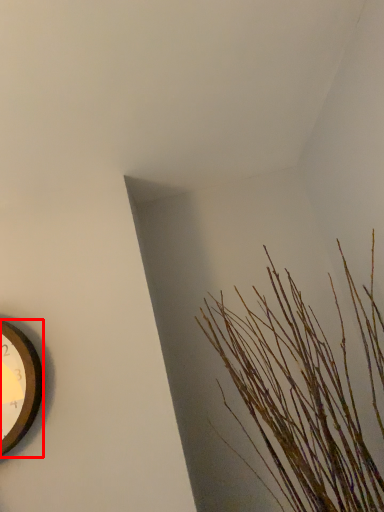
Question: From the image's perspective, where is wall clock (annotated by the red box) located relative to houseplant?

Choices:
 (A) above
 (B) below

Answer: (B)